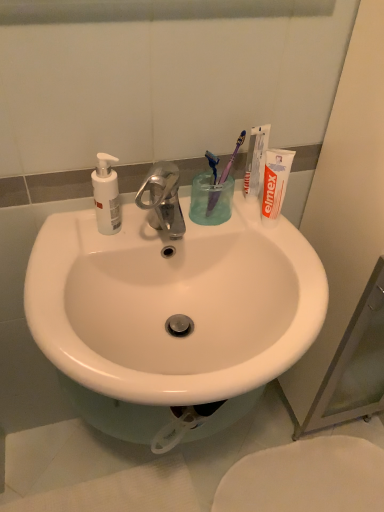
The width and height of the screenshot is (384, 512). I want to click on vacant area that lies to the right of white matte soap dispenser at left, so click(165, 229).